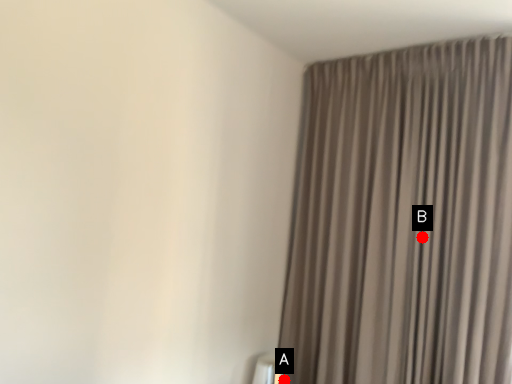
Question: Two points are circled on the image, labeled by A and B beside each circle. Among these points, which one is farthest from the camera?

Choices:
 (A) A is further
 (B) B is further

Answer: (A)